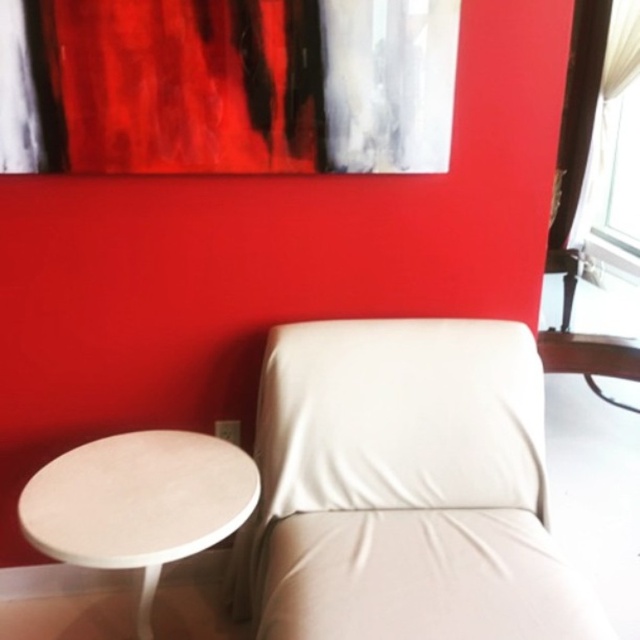
Can you confirm if white leather armchair at lower right is smaller than white matte table at lower left?

No.

Which is behind, point (296, 381) or point (202, 438)?

Point (202, 438)

At what (x,y) coordinates should I click in order to perform the action: click on white leather armchair at lower right. Please return your answer as a coordinate pair (x, y). The image size is (640, 640). Looking at the image, I should click on (404, 486).